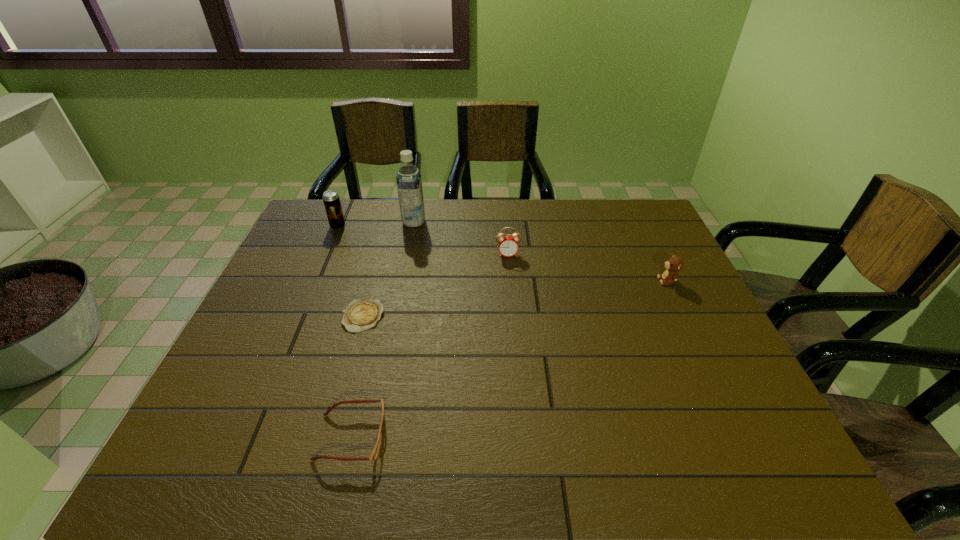
Locate an element on the screen. beer can that is at the far edge is located at coordinates (331, 199).

Where is `object present at the near edge`? The image size is (960, 540). object present at the near edge is located at coordinates (374, 454).

Find the location of a particular element. object located in the left edge section of the desktop is located at coordinates (331, 199).

You are a GUI agent. You are given a task and a screenshot of the screen. Output one action in this format:
    pyautogui.click(x=<x>, y=<y>)
    Task: Click on the object that is at the right edge
    
    Given the screenshot: What is the action you would take?
    pyautogui.click(x=674, y=264)

Identify the location of object located in the far left corner section of the desktop. (331, 199).

Locate an element on the screen. Image resolution: width=960 pixels, height=540 pixels. vacant space at the far edge of the desktop is located at coordinates (571, 203).

The image size is (960, 540). In the image, there is a desktop. Identify the location of vacant space at the near edge. (466, 473).

Identify the location of vacant space at the left edge of the desktop. The image size is (960, 540). (304, 278).

Identify the location of free space at the right edge of the desktop. (725, 425).

I want to click on vacant space at the far left corner of the desktop, so click(308, 215).